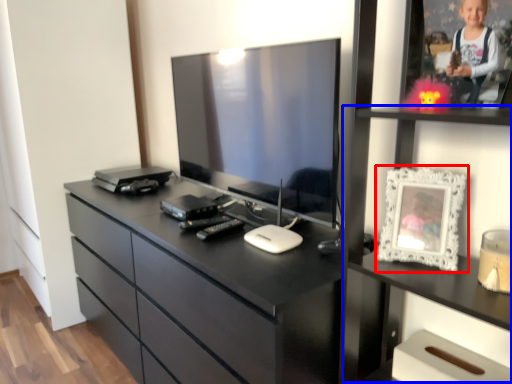
Question: Which of the following is the farthest to the observer, picture frame (highlighted by a red box) or tv cabinet (highlighted by a blue box)?

Choices:
 (A) picture frame
 (B) tv cabinet

Answer: (A)